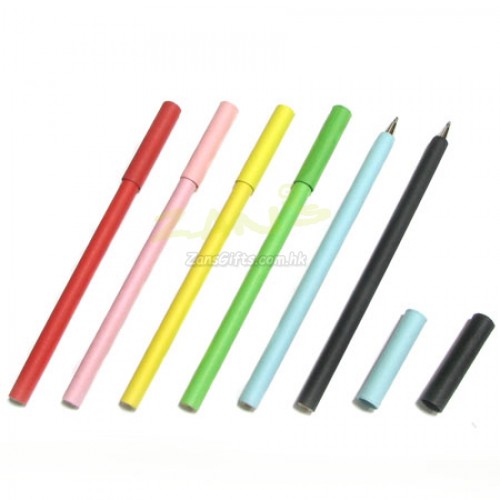
This screenshot has width=500, height=500. What are the coordinates of `pens` in the screenshot? It's located at (158, 142), (201, 145), (267, 136), (310, 151), (348, 174), (410, 193).